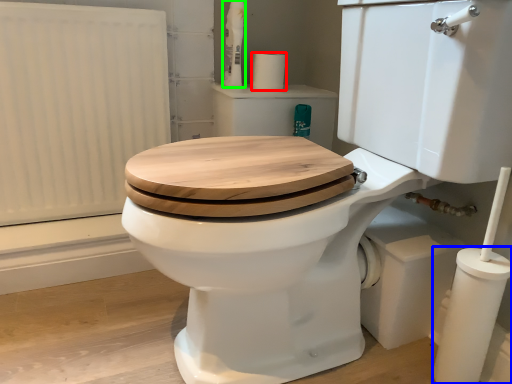
Question: Which object is positioned closest to toilet paper (highlighted by a red box)? Select from pillar (highlighted by a blue box) and toiletry (highlighted by a green box).

Choices:
 (A) pillar
 (B) toiletry

Answer: (B)